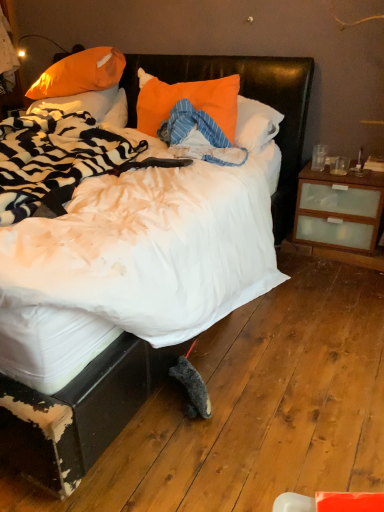
You are a GUI agent. You are given a task and a screenshot of the screen. Output one action in this format:
    pyautogui.click(x=<x>, y=<y>)
    Task: Click on the white soft bed at center
    The image size is (384, 512).
    Given the screenshot: What is the action you would take?
    pyautogui.click(x=78, y=413)

Measure the distance between orange fabric pillow at upper left, the third pillow from the right, and camera.

orange fabric pillow at upper left, the third pillow from the right, is 2.61 meters away from camera.

What do you see at coordinates (80, 74) in the screenshot? I see `orange fabric pillow at upper left, the second pillow viewed from the right` at bounding box center [80, 74].

How much space does orange fabric pillow at upper left, which appears as the second pillow when viewed from the left, occupy horizontally?

It is 13.93 inches.

Where is `white soft bed at center`? This screenshot has height=512, width=384. white soft bed at center is located at coordinates (78, 413).

Which pillow is the 2nd one when counting from the left side of the orange fabric pillow at center, the third pillow positioned from the left? Please provide its 2D coordinates.

[(91, 105)]

From the image's perspective, between orange fabric pillow at upper left, positioned as the 1th pillow in left-to-right order, and orange fabric pillow at center, which is the 1th pillow from right to left, which one is located above?

orange fabric pillow at upper left, positioned as the 1th pillow in left-to-right order, is shown above in the image.

Which of these two, orange fabric pillow at upper left, positioned as the 1th pillow in left-to-right order, or orange fabric pillow at center, which is the 1th pillow from right to left, is bigger?

orange fabric pillow at upper left, positioned as the 1th pillow in left-to-right order, is bigger.

Is orange fabric pillow at upper left, positioned as the 1th pillow in left-to-right order, wider or thinner than orange fabric pillow at center, the third pillow positioned from the left?

In the image, orange fabric pillow at upper left, positioned as the 1th pillow in left-to-right order, appears to be wider than orange fabric pillow at center, the third pillow positioned from the left.

From a real-world perspective, is orange fabric pillow at upper left, which appears as the second pillow when viewed from the left, below white soft bed at center?

No, from a real-world perspective, orange fabric pillow at upper left, which appears as the second pillow when viewed from the left, is not under white soft bed at center.

Is orange fabric pillow at upper left, which appears as the second pillow when viewed from the left, positioned with its back to white soft bed at center?

Yes, white soft bed at center is at the back of orange fabric pillow at upper left, which appears as the second pillow when viewed from the left.

Are orange fabric pillow at upper left, which appears as the second pillow when viewed from the left, and white soft bed at center located far from each other?

Actually, orange fabric pillow at upper left, which appears as the second pillow when viewed from the left, and white soft bed at center are a little close together.

Which of these two, orange fabric pillow at upper left, which appears as the second pillow when viewed from the left, or white soft bed at center, is bigger?

white soft bed at center is bigger.

How different are the orientations of orange fabric pillow at center, the third pillow positioned from the left, and orange fabric pillow at upper left, which appears as the second pillow when viewed from the left, in degrees?

0.000543 degrees separate the facing orientations of orange fabric pillow at center, the third pillow positioned from the left, and orange fabric pillow at upper left, which appears as the second pillow when viewed from the left.

Looking at the image, does orange fabric pillow at center, which is the 1th pillow from right to left, seem bigger or smaller compared to orange fabric pillow at upper left, the second pillow viewed from the right?

Considering their sizes, orange fabric pillow at center, which is the 1th pillow from right to left, takes up less space than orange fabric pillow at upper left, the second pillow viewed from the right.

Where is `pillow lying in front of the orange fabric pillow at upper left, the second pillow viewed from the right`? Image resolution: width=384 pixels, height=512 pixels. pillow lying in front of the orange fabric pillow at upper left, the second pillow viewed from the right is located at coordinates (187, 99).

Does orange fabric pillow at center, the third pillow positioned from the left, lie in front of orange fabric pillow at upper left, which appears as the second pillow when viewed from the left?

Yes, it is in front of orange fabric pillow at upper left, which appears as the second pillow when viewed from the left.

From the image's perspective, between orange fabric pillow at center, the third pillow positioned from the left, and white soft bed at center, who is located below?

white soft bed at center.

In the image, is orange fabric pillow at center, the third pillow positioned from the left, on the left side or the right side of white soft bed at center?

Clearly, orange fabric pillow at center, the third pillow positioned from the left, is on the right of white soft bed at center in the image.

Is white soft bed at center not within orange fabric pillow at upper left, the second pillow viewed from the right?

Yes.

From the image's perspective, is white soft bed at center positioned above or below orange fabric pillow at upper left, the second pillow viewed from the right?

Based on their image positions, white soft bed at center is located beneath orange fabric pillow at upper left, the second pillow viewed from the right.

Is orange fabric pillow at upper left, which appears as the second pillow when viewed from the left, at the back of white soft bed at center?

That's right, white soft bed at center is facing away from orange fabric pillow at upper left, which appears as the second pillow when viewed from the left.

Looking at their sizes, would you say white soft bed at center is wider or thinner than orange fabric pillow at upper left, which appears as the second pillow when viewed from the left?

white soft bed at center is wider than orange fabric pillow at upper left, which appears as the second pillow when viewed from the left.

Which object is further away from the camera, orange fabric pillow at upper left, the third pillow from the right, or white soft bed at center?

orange fabric pillow at upper left, the third pillow from the right, is further away from the camera.

Is orange fabric pillow at upper left, the third pillow from the right, not near white soft bed at center?

That's not correct — orange fabric pillow at upper left, the third pillow from the right, is a little close to white soft bed at center.

Find the location of a particular element. The height and width of the screenshot is (512, 384). the 1st pillow directly above the white soft bed at center (from a real-world perspective) is located at coordinates (91, 105).

Considering the points (104, 63) and (98, 92), which point is behind, point (104, 63) or point (98, 92)?

Point (98, 92)

From the picture: From the image's perspective, relative to orange fabric pillow at upper left, the third pillow from the right, is orange fabric pillow at upper left, which appears as the second pillow when viewed from the left, above or below?

Clearly, from the image's perspective, orange fabric pillow at upper left, which appears as the second pillow when viewed from the left, is above orange fabric pillow at upper left, the third pillow from the right.

Considering the relative sizes of orange fabric pillow at upper left, which appears as the second pillow when viewed from the left, and orange fabric pillow at upper left, positioned as the 1th pillow in left-to-right order, in the image provided, is orange fabric pillow at upper left, which appears as the second pillow when viewed from the left, bigger than orange fabric pillow at upper left, positioned as the 1th pillow in left-to-right order,?

Yes, orange fabric pillow at upper left, which appears as the second pillow when viewed from the left, is bigger than orange fabric pillow at upper left, positioned as the 1th pillow in left-to-right order.

Could you measure the distance between orange fabric pillow at upper left, which appears as the second pillow when viewed from the left, and orange fabric pillow at upper left, positioned as the 1th pillow in left-to-right order?

A distance of 5.10 inches exists between orange fabric pillow at upper left, which appears as the second pillow when viewed from the left, and orange fabric pillow at upper left, positioned as the 1th pillow in left-to-right order.

From the orange fabric pillow at upper left, the third pillow from the right, count 2nd pillows forward and point to it. Please provide its 2D coordinates.

[(187, 99)]

Where is `pillow that is the 3rd one above the white soft bed at center (from a real-world perspective)`? This screenshot has width=384, height=512. pillow that is the 3rd one above the white soft bed at center (from a real-world perspective) is located at coordinates (80, 74).

Looking at the image, which one is located closer to white soft bed at center, orange fabric pillow at upper left, positioned as the 1th pillow in left-to-right order, or orange fabric pillow at upper left, which appears as the second pillow when viewed from the left?

orange fabric pillow at upper left, positioned as the 1th pillow in left-to-right order, is closer to white soft bed at center.

Considering their positions, is orange fabric pillow at upper left, the second pillow viewed from the right, positioned closer to orange fabric pillow at center, the third pillow positioned from the left, than white soft bed at center?

Among the two, white soft bed at center is located nearer to orange fabric pillow at center, the third pillow positioned from the left.

From the image, which object appears to be farther from orange fabric pillow at upper left, the second pillow viewed from the right, white soft bed at center or orange fabric pillow at center, which is the 1th pillow from right to left?

white soft bed at center.

From the image, which object appears to be nearer to orange fabric pillow at center, the third pillow positioned from the left, orange fabric pillow at upper left, which appears as the second pillow when viewed from the left, or orange fabric pillow at upper left, positioned as the 1th pillow in left-to-right order?

The object closer to orange fabric pillow at center, the third pillow positioned from the left, is orange fabric pillow at upper left, positioned as the 1th pillow in left-to-right order.

From the image, which object appears to be nearer to white soft bed at center, orange fabric pillow at center, which is the 1th pillow from right to left, or orange fabric pillow at upper left, the third pillow from the right?

Among the two, orange fabric pillow at center, which is the 1th pillow from right to left, is located nearer to white soft bed at center.

Consider the image. Considering their positions, is orange fabric pillow at upper left, which appears as the second pillow when viewed from the left, positioned further to white soft bed at center than orange fabric pillow at center, which is the 1th pillow from right to left?

orange fabric pillow at upper left, which appears as the second pillow when viewed from the left.

When comparing their distances from orange fabric pillow at upper left, the second pillow viewed from the right, does white soft bed at center or orange fabric pillow at upper left, positioned as the 1th pillow in left-to-right order, seem closer?

The object closer to orange fabric pillow at upper left, the second pillow viewed from the right, is orange fabric pillow at upper left, positioned as the 1th pillow in left-to-right order.

Looking at the image, which one is located further to orange fabric pillow at center, the third pillow positioned from the left, orange fabric pillow at upper left, positioned as the 1th pillow in left-to-right order, or orange fabric pillow at upper left, the second pillow viewed from the right?

Based on the image, orange fabric pillow at upper left, the second pillow viewed from the right, appears to be further to orange fabric pillow at center, the third pillow positioned from the left.

Locate an element on the screen. The image size is (384, 512). pillow between orange fabric pillow at upper left, positioned as the 1th pillow in left-to-right order, and orange fabric pillow at center, the third pillow positioned from the left, in the horizontal direction is located at coordinates (80, 74).

Where is `pillow positioned between white soft bed at center and orange fabric pillow at upper left, the second pillow viewed from the right, from near to far`? This screenshot has width=384, height=512. pillow positioned between white soft bed at center and orange fabric pillow at upper left, the second pillow viewed from the right, from near to far is located at coordinates (187, 99).